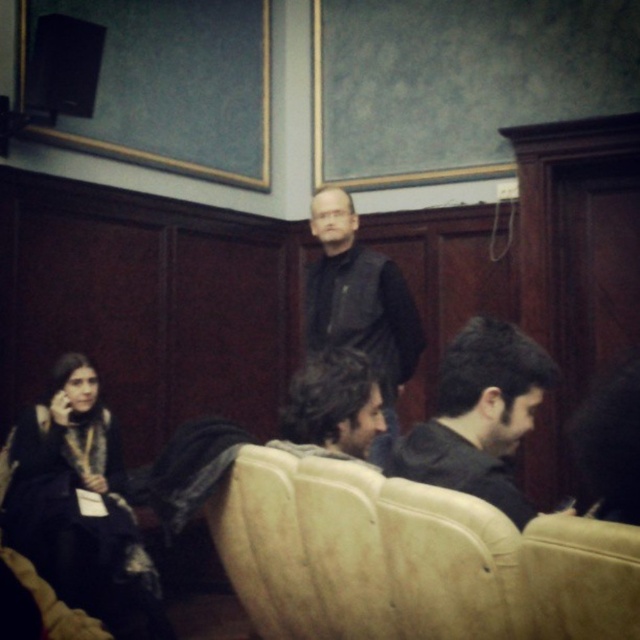
You are a photographer taking a portrait of the two people sitting on the sofa. You notice the dark gray hoodie at center and the dark brown hair at center. Which object should you focus on to capture the subject from the waist up?

The dark gray hoodie at center is above dark brown hair at center, so focusing on the dark gray hoodie at center will ensure the subject from the waist up is captured properly.

You are standing in the meeting room and need to find the dark matte dress at lower left. According to the scene description, where should you look relative to the sofa?

The dark matte dress at lower left is located at point [80,506], which is to the lower left of the sofa.

You are standing in the meeting room and need to hand a document to both the person in the dark matte dress at lower left and the person in the dark gray hoodie at center. Which person should you approach first to ensure you can reach them without moving past the other?

You should approach the dark matte dress at lower left first because it is closer to you than the dark gray hoodie at center, so you can reach them without needing to move past the other person.